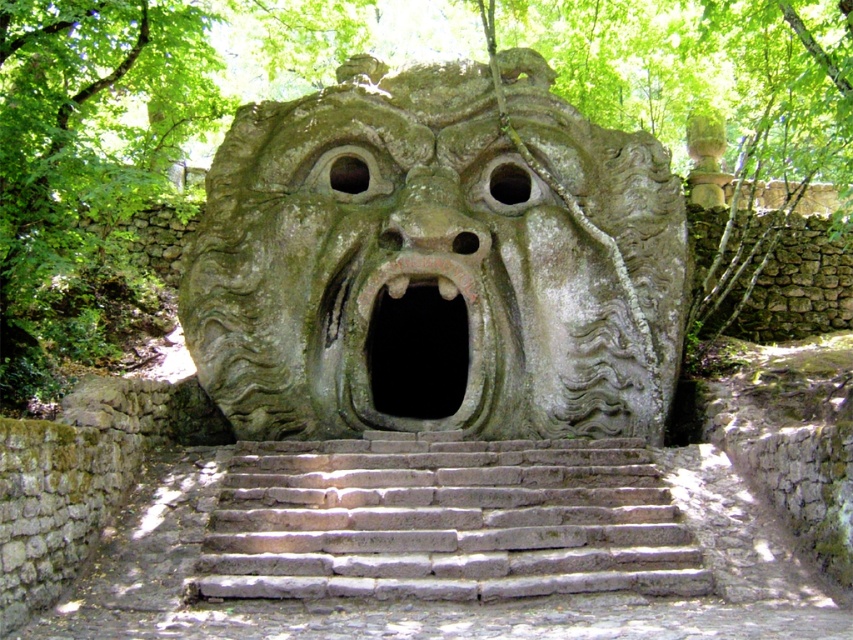
Question: Which object is closer to the camera taking this photo?

Choices:
 (A) gray stone stairs at center
 (B) green stone face at center

Answer: (A)

Question: Is green stone face at center wider than gray stone stairs at center?

Choices:
 (A) no
 (B) yes

Answer: (B)

Question: Does gray stone stairs at center appear over rusty metal mouth at center?

Choices:
 (A) yes
 (B) no

Answer: (B)

Question: Can you confirm if gray stone stairs at center is thinner than rusty metal mouth at center?

Choices:
 (A) no
 (B) yes

Answer: (A)

Question: Which object is positioned closest to the green stone face at center?

Choices:
 (A) gray stone stairs at center
 (B) rusty metal mouth at center

Answer: (B)

Question: Among these points, which one is nearest to the camera?

Choices:
 (A) (477, 324)
 (B) (386, 326)

Answer: (A)